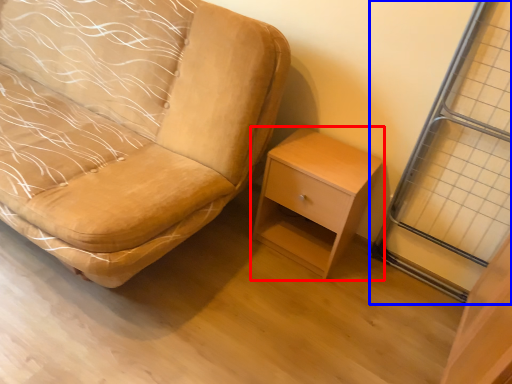
Question: Among these objects, which one is farthest to the camera, nightstand (highlighted by a red box) or screen door (highlighted by a blue box)?

Choices:
 (A) nightstand
 (B) screen door

Answer: (A)